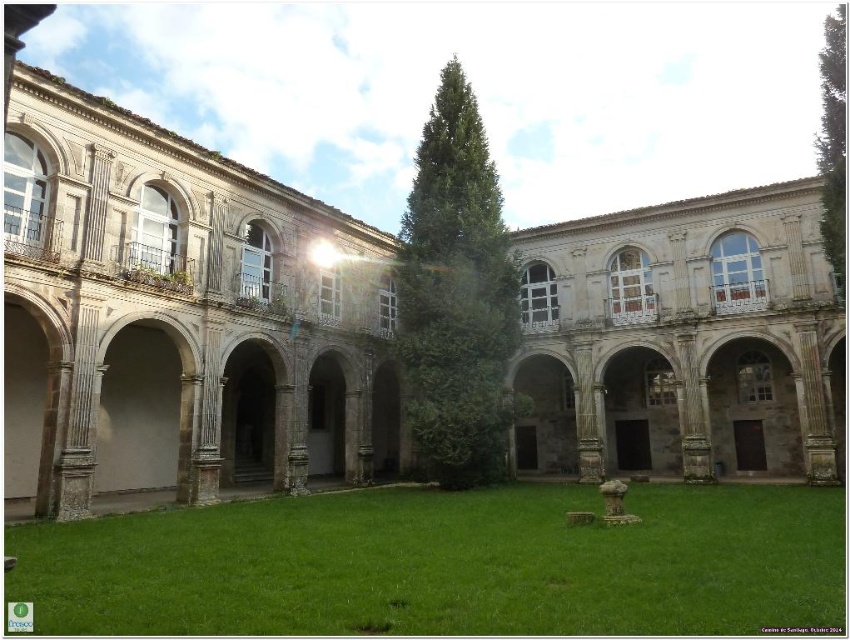
Which of these two, green grass at center or green leafy tree at right, stands shorter?

green grass at center

Which is behind, point (622, 618) or point (840, 108)?

Point (840, 108)

Does point (303, 602) come closer to viewer compared to point (824, 83)?

Yes, it is.

Image resolution: width=850 pixels, height=640 pixels. In order to click on green grass at center in this screenshot , I will do 445,564.

Does green leafy tree at center have a lesser width compared to green leafy tree at right?

Indeed, green leafy tree at center has a lesser width compared to green leafy tree at right.

From the picture: Between green leafy tree at center and green leafy tree at right, which one has more height?

green leafy tree at right

This screenshot has height=640, width=850. What are the coordinates of `green leafy tree at center` in the screenshot? It's located at (456, 296).

Locate an element on the screen. Image resolution: width=850 pixels, height=640 pixels. green leafy tree at center is located at coordinates click(456, 296).

Does point (652, 500) come in front of point (443, 456)?

Yes, point (652, 500) is closer to viewer.

Which of these two, green grass at center or green leafy tree at center, stands shorter?

Standing shorter between the two is green grass at center.

Describe the element at coordinates (445, 564) in the screenshot. I see `green grass at center` at that location.

At what (x,y) coordinates should I click in order to perform the action: click on green grass at center. Please return your answer as a coordinate pair (x, y). This screenshot has width=850, height=640. Looking at the image, I should click on (445, 564).